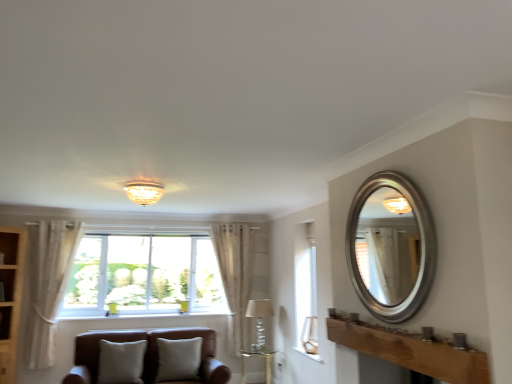
Question: In terms of height, does white glass window at center look taller or shorter compared to matte glass lampshade at upper center, acting as the 3th lamp starting from the bottom?

Choices:
 (A) tall
 (B) short

Answer: (A)

Question: From a real-world perspective, relative to matte glass lampshade at upper center, the third lamp from the right, is white glass window at center vertically above or below?

Choices:
 (A) above
 (B) below

Answer: (B)

Question: Which object is the farthest from the matte glass lampshade at upper center, placed as the 3th lamp when sorted from back to front?

Choices:
 (A) white textured stone at lower center
 (B) clear glass table at lower center
 (C) beige fabric pillow at lower left, the 1th pillow when ordered from left to right
 (D) brown wooden mantle at lower right
 (E) white glass window at center

Answer: (B)

Question: Estimate the real-world distances between objects in this image. Which object is farther from the white textured stone at lower center?

Choices:
 (A) wooden cabinet at left
 (B) white glass window at center
 (C) clear glass table at lower center
 (D) translucent glass lampshade at center, arranged as the 1th lamp when viewed from the back
 (E) gold glass vase at lower right, the 2th lamp viewed from the top

Answer: (A)